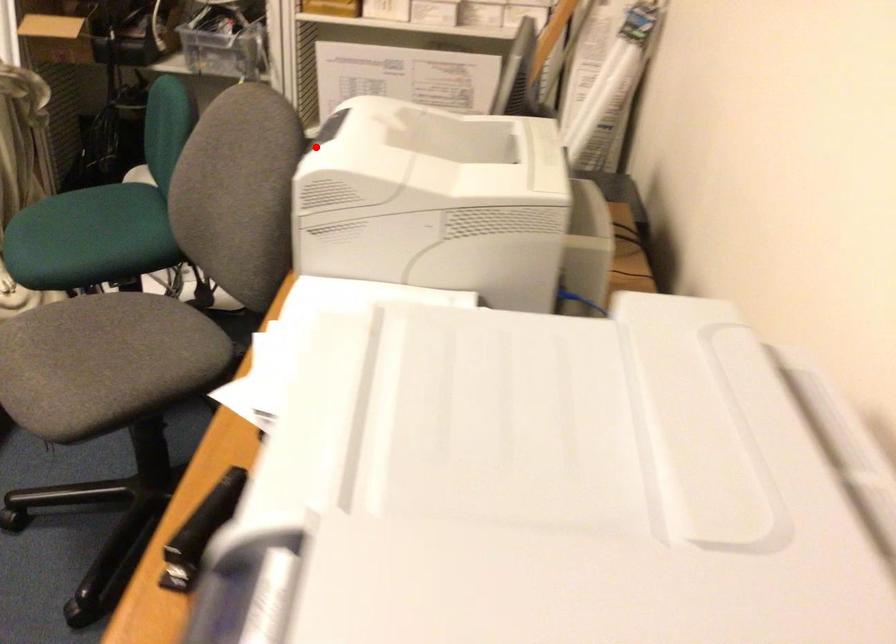
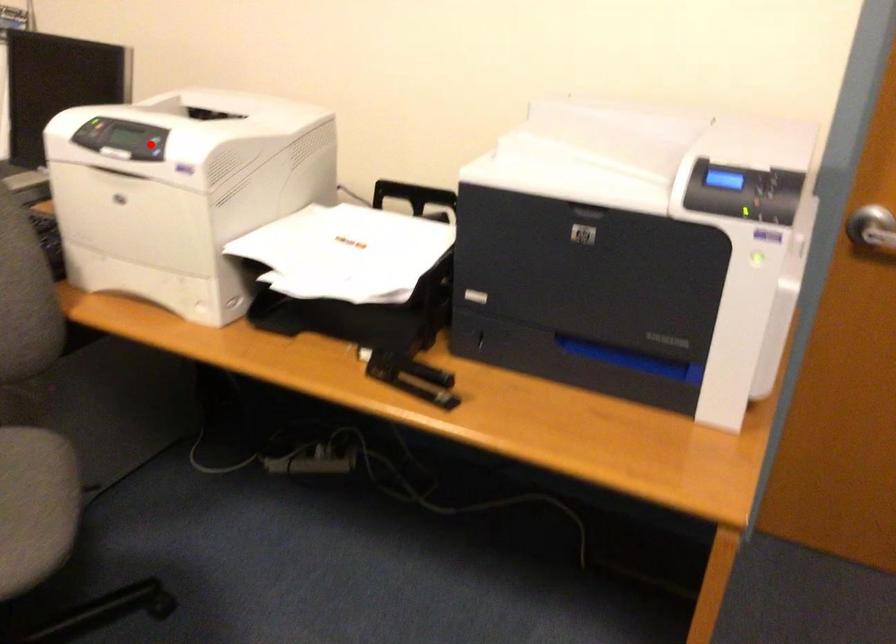
I am providing you with two images of the same scene from different viewpoints. A red point is marked on the first image and another point is marked on the second image. Do the highlighted points in image1 and image2 indicate the same real-world spot?

Yes